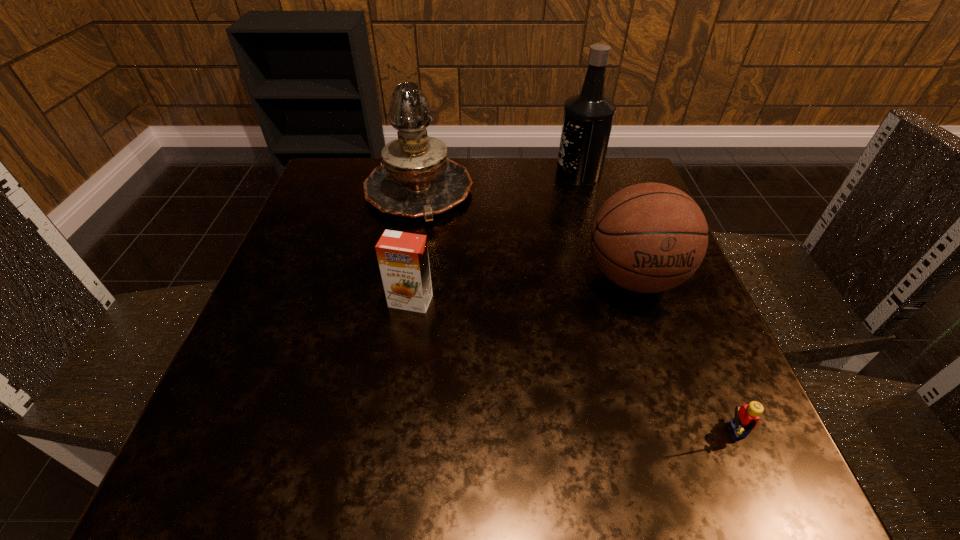
At what (x,y) coordinates should I click in order to perform the action: click on free spot that satisfies the following two spatial constraints: 1. on the front side of the oil lamp; 2. on the left side of the orange juice. Please return your answer as a coordinate pair (x, y). Looking at the image, I should click on (399, 301).